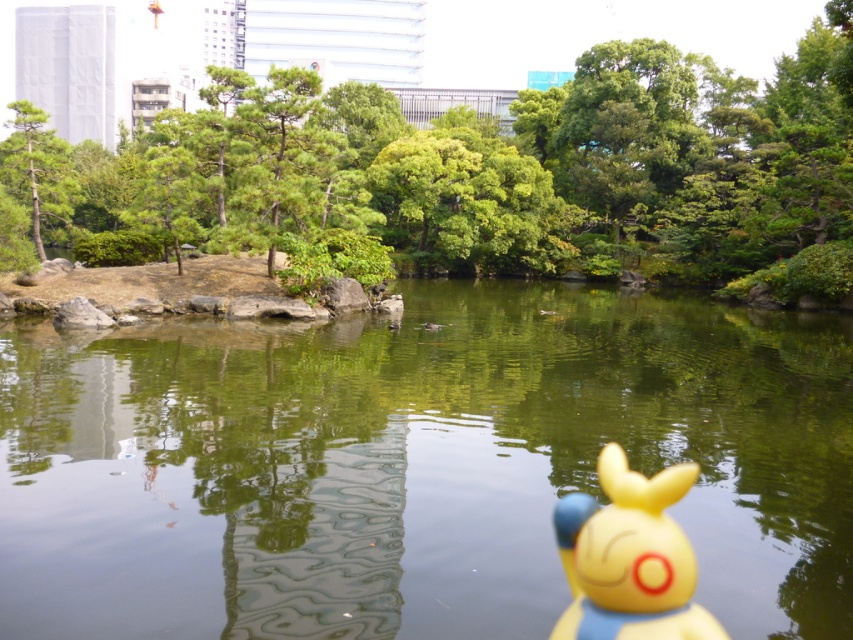
From the picture: You are standing in the park and looking at the pond. There is a point marked at coordinates [416,465]. What is located at this point?

The point at coordinates [416,465] is where the green reflective water at center is located.

You are standing in the park and want to take a photo of the green leafy tree at upper center. If your camera has a maximum focus range of 20 meters, will you be able to capture the tree clearly?

→ The green leafy tree at upper center is 19.85 meters away from the viewer. Since the camera can focus up to 20 meters, you can capture the tree clearly.

You are standing in the park and see the green leafy tree at upper center and the yellow rubber duck at lower right. Which object is higher in the image?

The green leafy tree at upper center is higher than the yellow rubber duck at lower right.